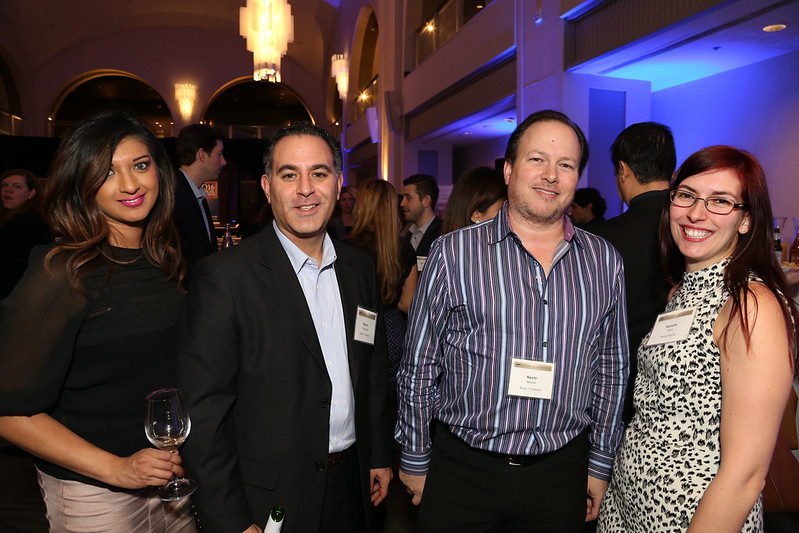
What are the coordinates of `archway` in the screenshot? It's located at (149, 92), (260, 120).